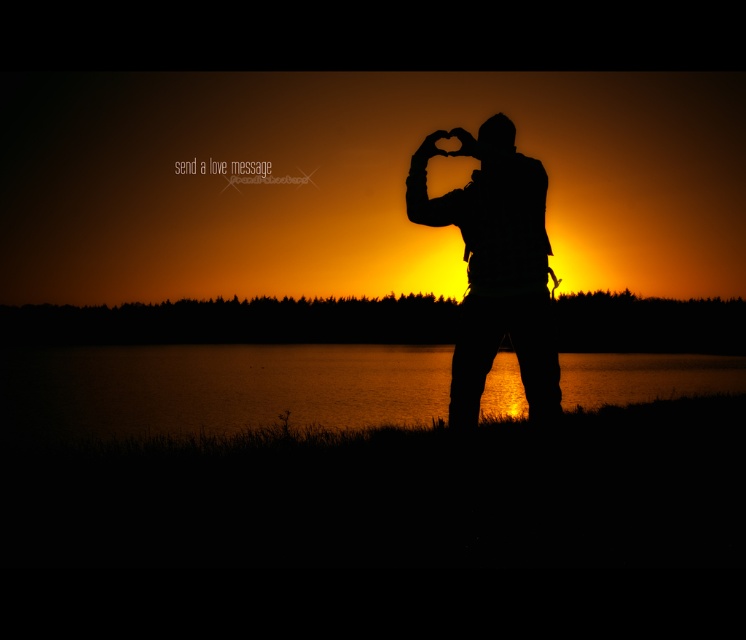
Question: Which point is closer to the camera taking this photo?

Choices:
 (A) (336, 403)
 (B) (492, 134)

Answer: (B)

Question: Is glistening water at center thinner than silhouette figure at center?

Choices:
 (A) yes
 (B) no

Answer: (B)

Question: Is glistening water at center thinner than silhouette figure at center?

Choices:
 (A) yes
 (B) no

Answer: (B)

Question: Does glistening water at center have a lesser width compared to silhouette figure at center?

Choices:
 (A) yes
 (B) no

Answer: (B)